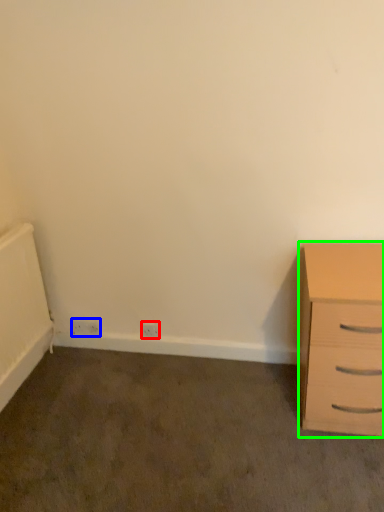
Question: Which is nearer to the electric outlet (highlighted by a red box)? electric outlet (highlighted by a blue box) or chest of drawers (highlighted by a green box).

Choices:
 (A) electric outlet
 (B) chest of drawers

Answer: (A)